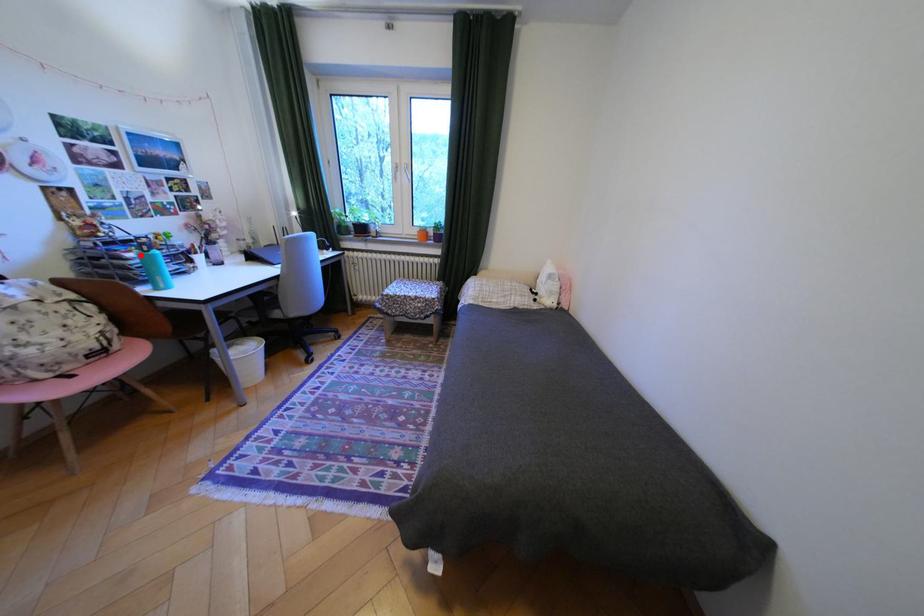
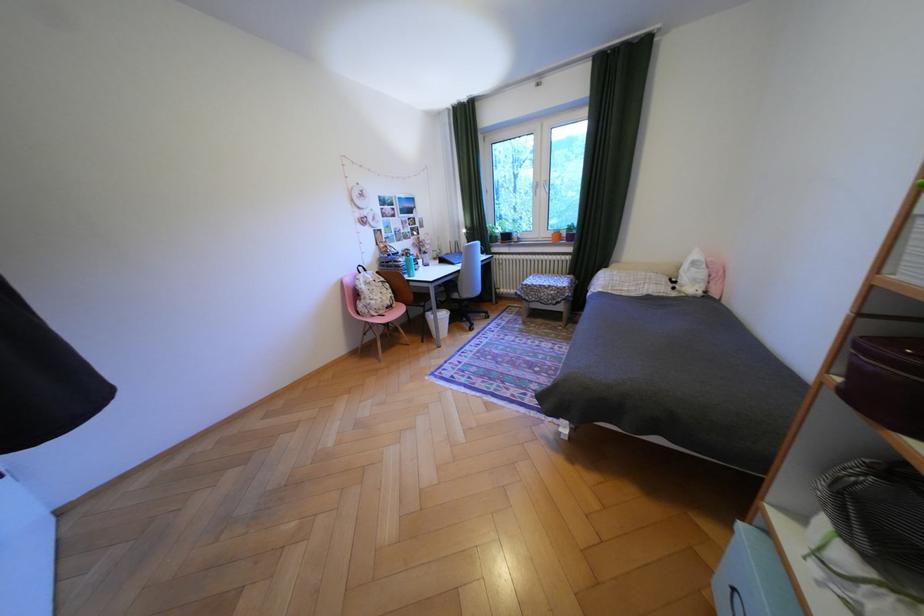
Question: I am providing you with two images of the same scene from different viewpoints. Image1 has a red point marked. In image2, the corresponding 3D location appears at what relative position? Reply with the corresponding letter.

Choices:
 (A) Closer
 (B) Farther

Answer: (A)